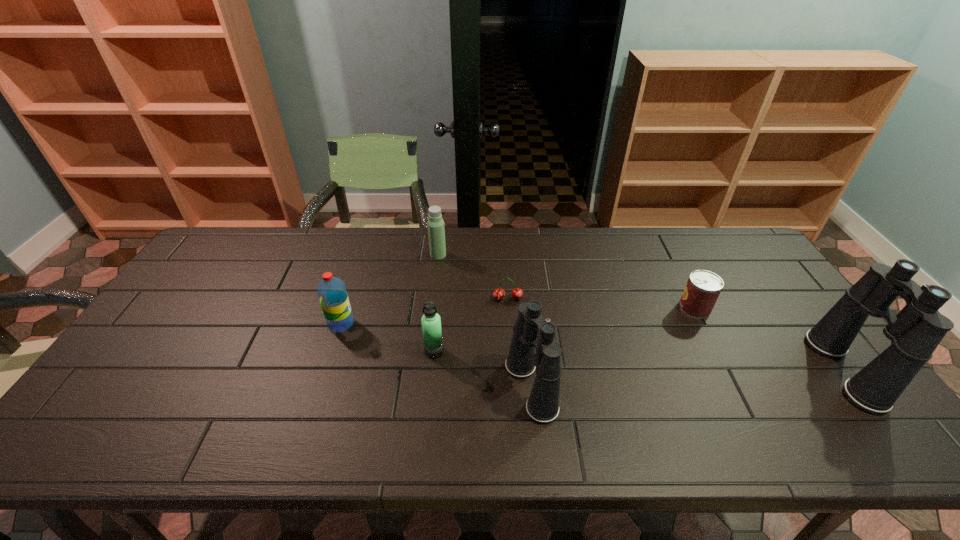
At what (x,y) coordinates should I click in order to perform the action: click on the shorter binoculars. Please return your answer as a coordinate pair (x, y). The height and width of the screenshot is (540, 960). Looking at the image, I should click on (542, 406).

You are a GUI agent. You are given a task and a screenshot of the screen. Output one action in this format:
    pyautogui.click(x=<x>, y=<y>)
    Task: Click on the sixth shortest object
    Image resolution: width=960 pixels, height=540 pixels.
    Given the screenshot: What is the action you would take?
    (542, 406)

Locate an element on the screen. The image size is (960, 540). the tallest object is located at coordinates 915,332.

You are a GUI agent. You are given a task and a screenshot of the screen. Output one action in this format:
    pyautogui.click(x=<x>, y=<y>)
    Task: Click on the taller binoculars
    The height and width of the screenshot is (540, 960).
    Given the screenshot: What is the action you would take?
    pyautogui.click(x=915, y=332)

At what (x,y) coordinates should I click in order to perform the action: click on the farther thermos bottle. Please return your answer as a coordinate pair (x, y). The height and width of the screenshot is (540, 960). Looking at the image, I should click on (436, 231).

The width and height of the screenshot is (960, 540). Find the location of `the sixth object from left to right`. the sixth object from left to right is located at coordinates (703, 287).

Where is `can`? The width and height of the screenshot is (960, 540). can is located at coordinates (703, 287).

Locate an element on the screen. cherry is located at coordinates pos(517,293).

This screenshot has width=960, height=540. I want to click on the nearer thermos bottle, so click(431, 322).

Image resolution: width=960 pixels, height=540 pixels. What are the coordinates of `the leftmost object` in the screenshot? It's located at (332, 293).